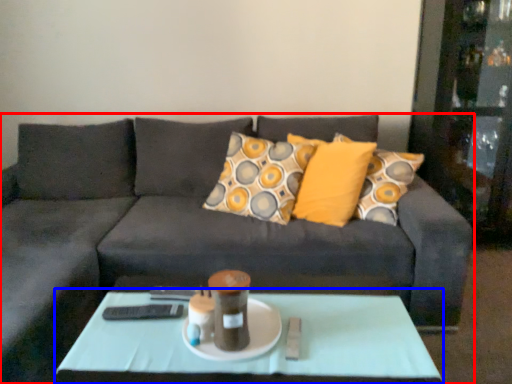
Question: Which of the following is the farthest to the observer, studio couch (highlighted by a red box) or coffee table (highlighted by a blue box)?

Choices:
 (A) studio couch
 (B) coffee table

Answer: (B)